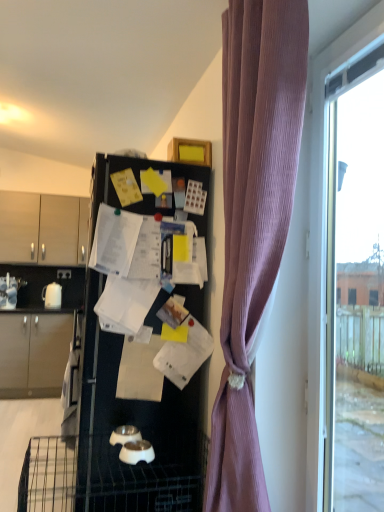
Question: Is purple ribbed curtain at right turned away from black matte refrigerator at center?

Choices:
 (A) no
 (B) yes

Answer: (A)

Question: Considering the relative positions of purple ribbed curtain at right and black matte refrigerator at center in the image provided, is purple ribbed curtain at right behind black matte refrigerator at center?

Choices:
 (A) yes
 (B) no

Answer: (B)

Question: From the image's perspective, is purple ribbed curtain at right on top of black matte refrigerator at center?

Choices:
 (A) yes
 (B) no

Answer: (A)

Question: Does purple ribbed curtain at right appear on the left side of black matte refrigerator at center?

Choices:
 (A) yes
 (B) no

Answer: (B)

Question: Does purple ribbed curtain at right have a lesser height compared to black matte refrigerator at center?

Choices:
 (A) yes
 (B) no

Answer: (B)

Question: Looking at the image, does matte wood cabinets at left, placed as the 1th cabinetry when sorted from top to bottom, seem bigger or smaller compared to white glossy kettle at left?

Choices:
 (A) big
 (B) small

Answer: (A)

Question: Would you say matte wood cabinets at left, placed as the 1th cabinetry when sorted from top to bottom, is inside or outside white glossy kettle at left?

Choices:
 (A) outside
 (B) inside

Answer: (A)

Question: From a real-world perspective, is matte wood cabinets at left, acting as the 2th cabinetry starting from the bottom, positioned above or below white glossy kettle at left?

Choices:
 (A) below
 (B) above

Answer: (B)

Question: From the image's perspective, is matte wood cabinets at left, placed as the 1th cabinetry when sorted from top to bottom, positioned above or below white glossy kettle at left?

Choices:
 (A) above
 (B) below

Answer: (A)

Question: From the image's perspective, is white glossy kettle at left located above or below black matte refrigerator at center?

Choices:
 (A) above
 (B) below

Answer: (A)

Question: From their relative heights in the image, would you say white glossy kettle at left is taller or shorter than black matte refrigerator at center?

Choices:
 (A) short
 (B) tall

Answer: (A)

Question: Does point (48, 288) appear closer or farther from the camera than point (182, 462)?

Choices:
 (A) closer
 (B) farther

Answer: (B)

Question: In terms of width, does white glossy kettle at left look wider or thinner when compared to black matte refrigerator at center?

Choices:
 (A) wide
 (B) thin

Answer: (B)

Question: Considering the positions of point (44, 390) and point (56, 285), is point (44, 390) closer or farther from the camera than point (56, 285)?

Choices:
 (A) farther
 (B) closer

Answer: (B)

Question: Considering the positions of matte beige cabinet at left, arranged as the 2th cabinetry when viewed from the top, and white glossy kettle at left in the image, is matte beige cabinet at left, arranged as the 2th cabinetry when viewed from the top, taller or shorter than white glossy kettle at left?

Choices:
 (A) short
 (B) tall

Answer: (B)